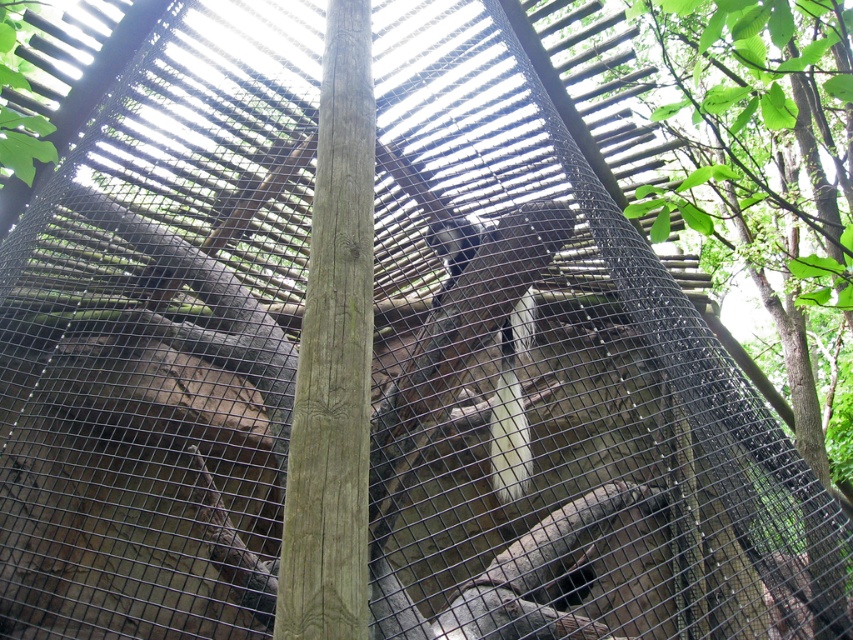
Is point (303, 360) positioned before point (496, 426)?

That is True.

Does smooth brown wood pole at center have a lesser height compared to white fur monkey at center?

No.

Between point (355, 12) and point (460, 262), which one is positioned behind?

The point (460, 262) is more distant.

This screenshot has width=853, height=640. Find the location of `smooth brown wood pole at center`. smooth brown wood pole at center is located at coordinates (334, 356).